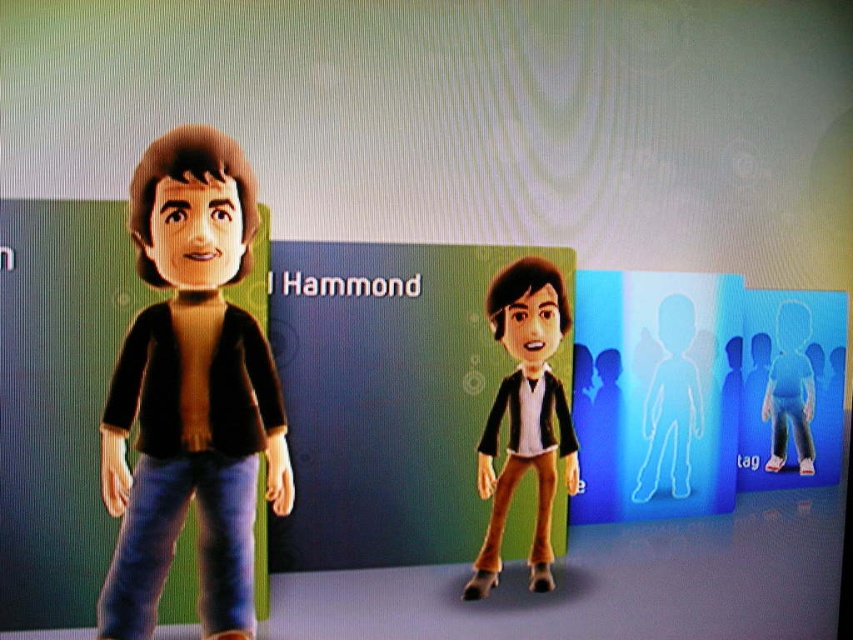
Question: Based on their relative distances, which object is farther from the transparent plastic figure at center?

Choices:
 (A) transparent blue figure at center
 (B) matte black jacket at left

Answer: (B)

Question: Can you confirm if matte black jacket at center is positioned to the right of transparent blue figure at center?

Choices:
 (A) no
 (B) yes

Answer: (A)

Question: Does matte black jacket at left have a smaller size compared to transparent blue figure at center?

Choices:
 (A) yes
 (B) no

Answer: (B)

Question: Among these objects, which one is farthest from the camera?

Choices:
 (A) matte black jacket at center
 (B) matte black jacket at left

Answer: (A)

Question: Is matte black jacket at left to the right of transparent blue figure at center from the viewer's perspective?

Choices:
 (A) no
 (B) yes

Answer: (A)

Question: Which of the following is the closest to the observer?

Choices:
 (A) matte black jacket at left
 (B) transparent plastic figure at center

Answer: (A)